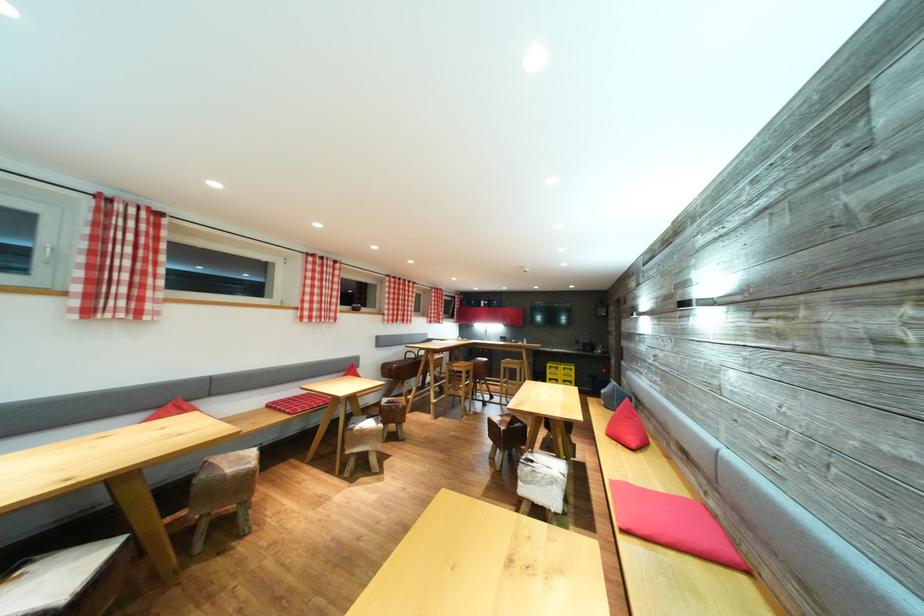
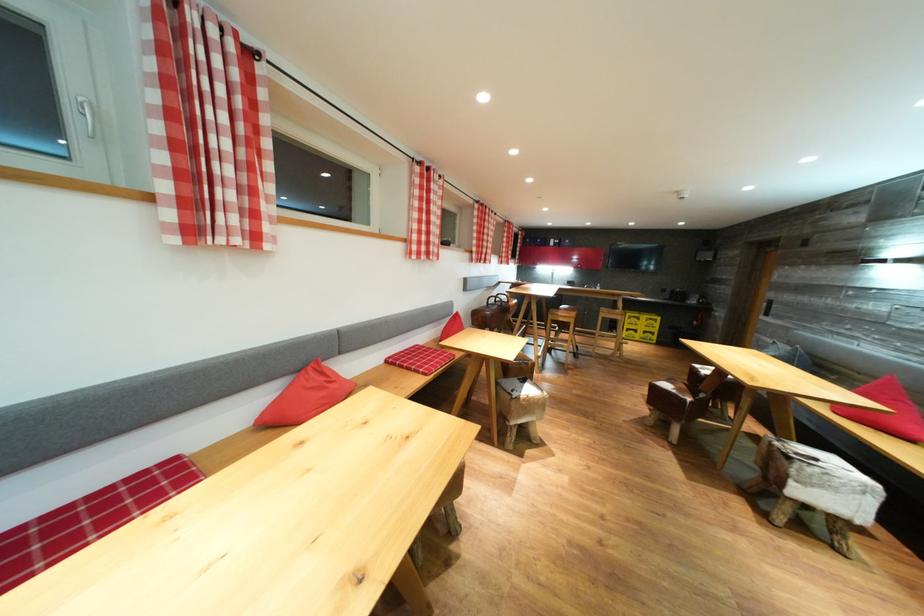
Locate, in the second image, the point that corresponds to pixel 516 424 in the first image.

(689, 392)